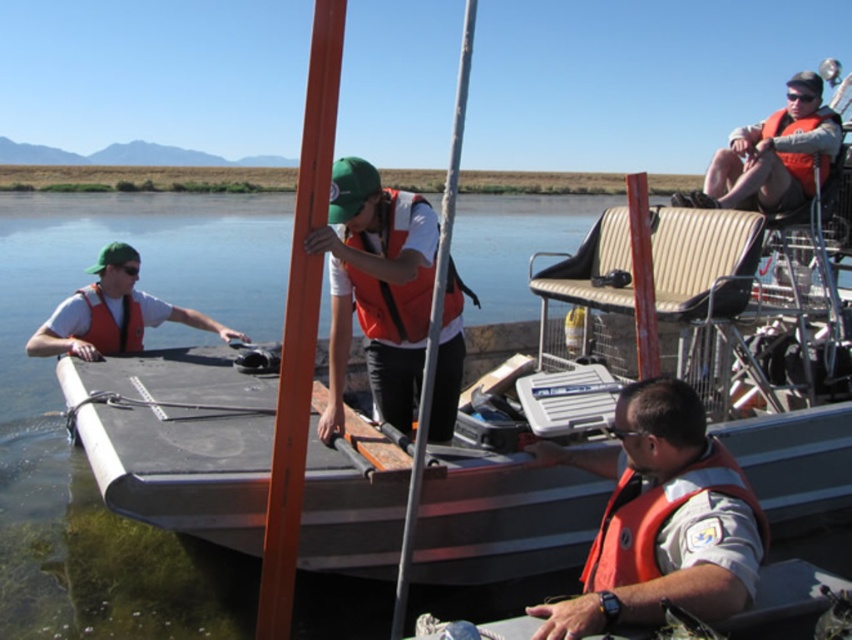
You are a safety inspector checking the equipment in the scene. You notice two orange life preservers. The first is the matte orange life vest at center, and the second is the orange life jacket at lower right. Which one is taller?

The matte orange life vest at center is taller than the orange life jacket at lower right.

You are a safety inspector checking the equipment on the boat. You notice two orange flotation devices. The first is the matte orange life vest at center, and the second is the orange life jacket at lower right. Based on their placement and size, which one is more likely to be the primary flotation device for the seated individual?

The matte orange life vest at center is more likely to be the primary flotation device for the seated individual since it is positioned at the center, closer to where the person is seated, and might be wider, making it more accessible and appropriate for use.